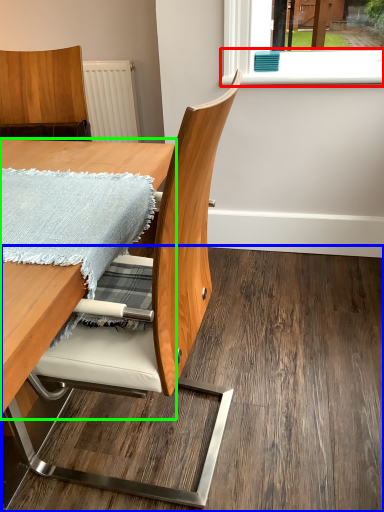
Question: Which is nearer to the window sill (highlighted by a red box)? plywood (highlighted by a blue box) or table (highlighted by a green box).

Choices:
 (A) plywood
 (B) table

Answer: (B)